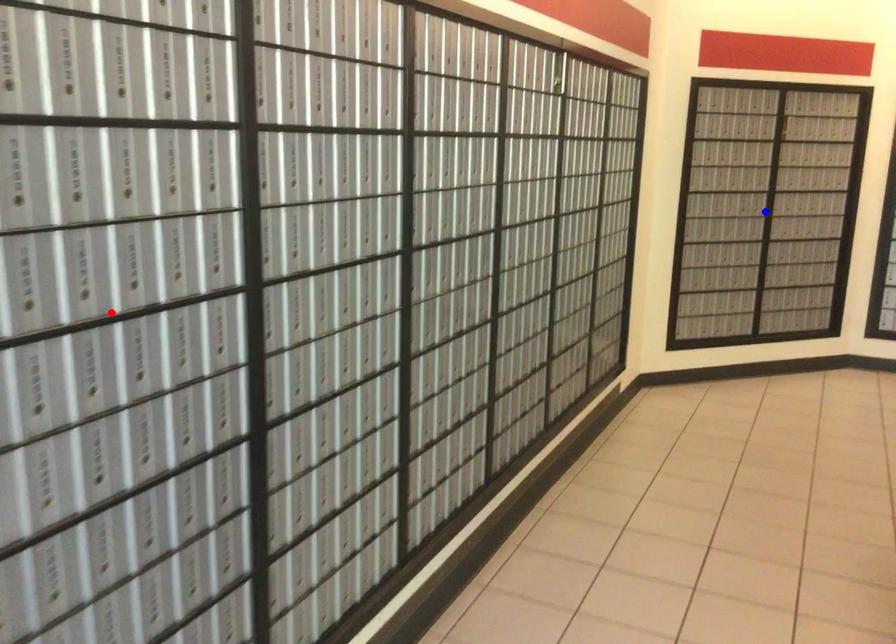
Question: Which of the two points in the image is closer to the camera?

Choices:
 (A) Blue point is closer.
 (B) Red point is closer.

Answer: (B)